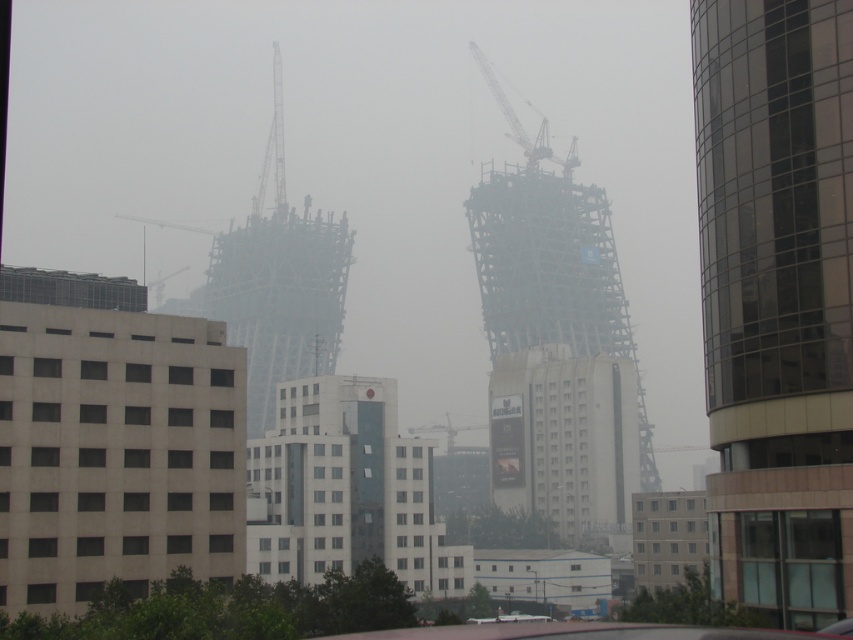
Question: Can you confirm if glassy reflective tower at right is smaller than metallic gray crane at center?

Choices:
 (A) no
 (B) yes

Answer: (B)

Question: Observing the image, what is the correct spatial positioning of white glass building at center in reference to metallic gray crane at center?

Choices:
 (A) right
 (B) left

Answer: (B)

Question: Among these points, which one is farthest from the camera?

Choices:
 (A) (585, 193)
 (B) (254, 262)
 (C) (276, 196)

Answer: (C)

Question: Can you confirm if metallic gray crane at center-left is bigger than metallic gray crane at center?

Choices:
 (A) no
 (B) yes

Answer: (B)

Question: Which point appears closest to the camera in this image?

Choices:
 (A) (454, 432)
 (B) (776, 412)

Answer: (B)

Question: Which object appears farthest from the camera in this image?

Choices:
 (A) metallic scaffolding tower at center
 (B) metallic gray crane at center
 (C) metallic gray crane at center-left

Answer: (C)